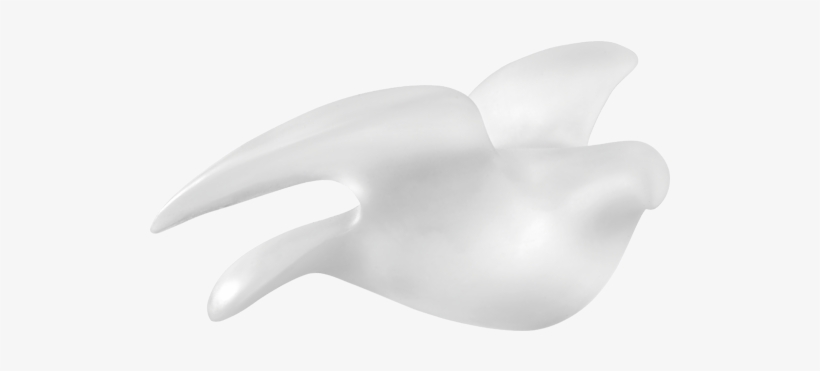
Image resolution: width=820 pixels, height=371 pixels. Find the location of `bird figurine`. bird figurine is located at coordinates coord(312,262), coord(526,267), coord(543,103), coord(403,137).